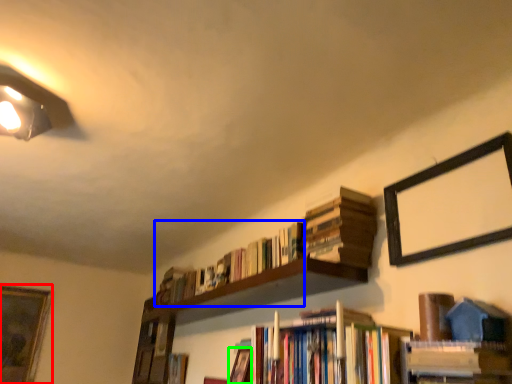
Question: Estimate the real-world distances between objects in this image. Which object is closer to picture frame (highlighted by a red box), book (highlighted by a blue box) or book (highlighted by a green box)?

Choices:
 (A) book
 (B) book

Answer: (A)